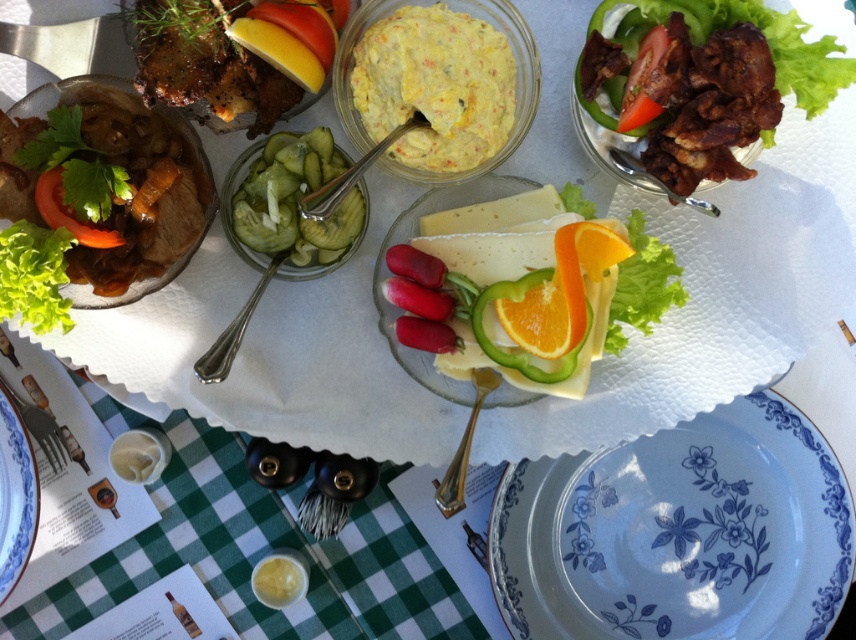
You are at a picnic and want to serve yourself from the blue floral plate at center and the yellow creamy spread at center. Which item is located below the other?

The blue floral plate at center is positioned under the yellow creamy spread at center, so the blue floral plate is below the yellow creamy spread.

What is located at the coordinates point (x=678, y=532)?

The blue floral plate at center is located at point (x=678, y=532).

You are at a picnic and want to place the green pickled cucumber at center onto the blue floral plate at lower right. Will the cucumber fit on the plate?

The green pickled cucumber at center is wider than the blue floral plate at lower right, so it won not fit on the plate.